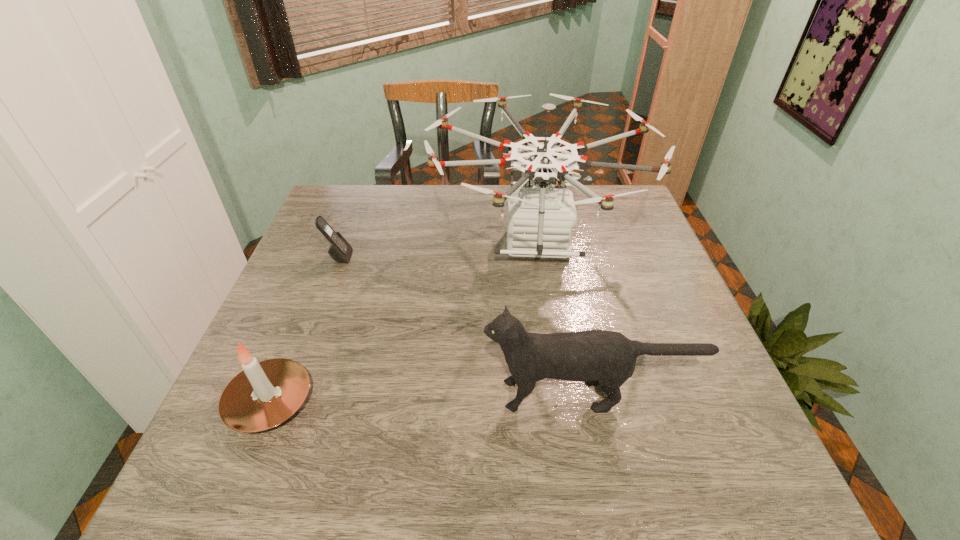
Where is `object present at the far edge`? This screenshot has height=540, width=960. object present at the far edge is located at coordinates (540, 218).

The width and height of the screenshot is (960, 540). I want to click on candle at the left edge, so click(265, 394).

Where is `cellular telephone located in the left edge section of the desktop`? The image size is (960, 540). cellular telephone located in the left edge section of the desktop is located at coordinates tap(340, 250).

Where is `drone that is at the right edge`? drone that is at the right edge is located at coordinates (540, 218).

Where is `cat present at the right edge`? The width and height of the screenshot is (960, 540). cat present at the right edge is located at coordinates (606, 358).

The height and width of the screenshot is (540, 960). Identify the location of object that is at the far right corner. [540, 218].

In the image, there is a desktop. Where is `free space at the far edge`? The height and width of the screenshot is (540, 960). free space at the far edge is located at coordinates (407, 195).

Locate an element on the screen. free region at the near edge of the desktop is located at coordinates (660, 484).

This screenshot has width=960, height=540. In the image, there is a desktop. Find the location of `vacant space at the left edge`. vacant space at the left edge is located at coordinates (300, 281).

Find the location of a particular element. Image resolution: width=960 pixels, height=540 pixels. vacant area at the right edge of the desktop is located at coordinates (702, 393).